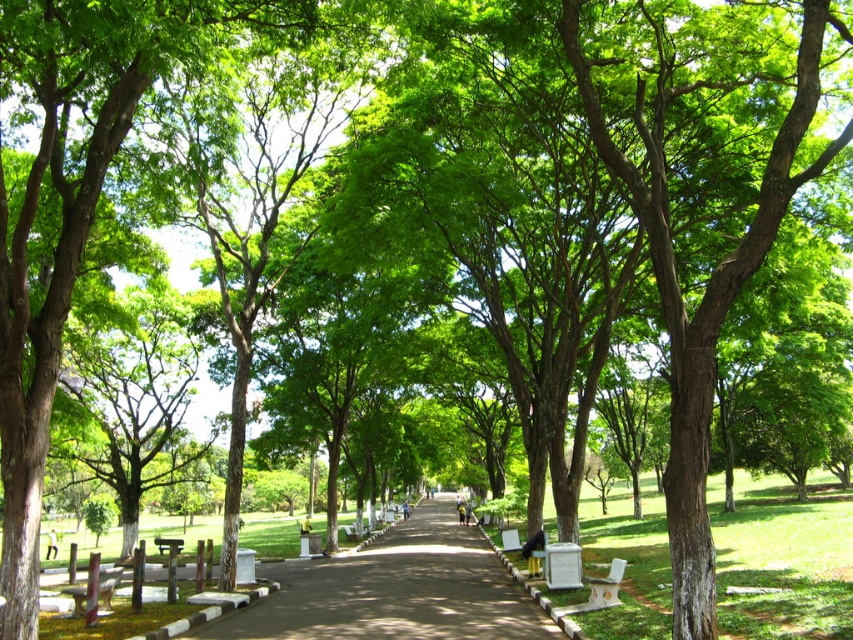
Which of these two, brown asphalt road at center or wooden park bench at center, stands shorter?

wooden park bench at center

Is brown asphalt road at center above wooden park bench at center?

No.

Measure the distance between brown asphalt road at center and camera.

The distance of brown asphalt road at center from camera is 12.92 meters.

Locate an element on the screen. Image resolution: width=853 pixels, height=640 pixels. brown asphalt road at center is located at coordinates (395, 589).